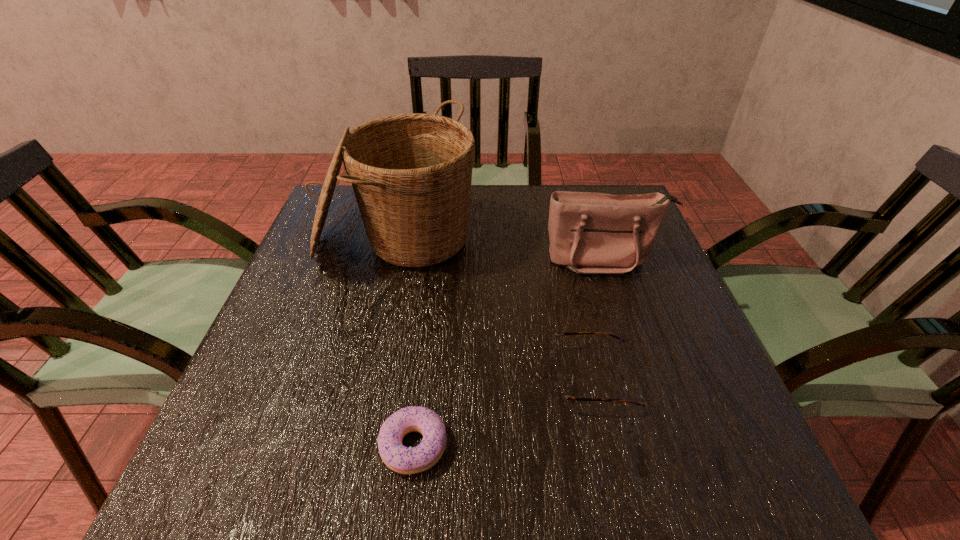
What are the coordinates of `object situated at the far edge` in the screenshot? It's located at pyautogui.click(x=411, y=173).

At what (x,y) coordinates should I click in order to perform the action: click on object present at the near edge. Please return your answer as a coordinate pair (x, y). The width and height of the screenshot is (960, 540). Looking at the image, I should click on (401, 459).

Locate an element on the screen. object located in the left edge section of the desktop is located at coordinates (411, 173).

Locate an element on the screen. shoulder bag that is at the right edge is located at coordinates (590, 233).

This screenshot has height=540, width=960. Identify the location of spectacles present at the right edge. (560, 395).

What are the coordinates of `object present at the far left corner` in the screenshot? It's located at (411, 173).

Locate an element on the screen. The height and width of the screenshot is (540, 960). vacant space at the far edge of the desktop is located at coordinates (484, 190).

Identify the location of free space at the near edge of the desktop. The image size is (960, 540). pos(610,454).

At what (x,y) coordinates should I click in order to perform the action: click on free location at the left edge. Please return your answer as a coordinate pair (x, y). Looking at the image, I should click on [300, 347].

You are a GUI agent. You are given a task and a screenshot of the screen. Output one action in this format:
    pyautogui.click(x=<x>, y=<y>)
    Task: Click on the vacant region at the right edge
    This screenshot has width=960, height=540.
    Given the screenshot: What is the action you would take?
    pyautogui.click(x=728, y=392)